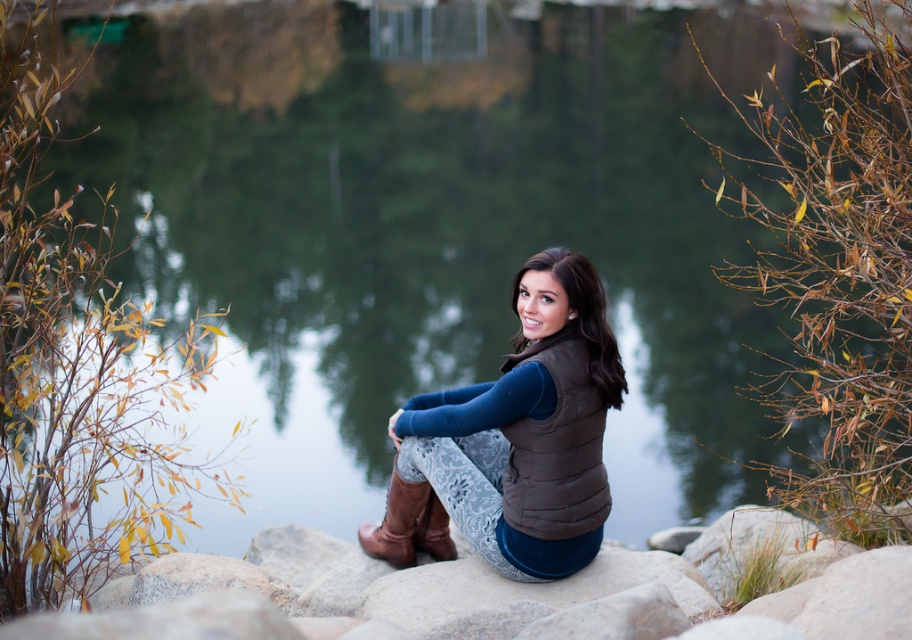
You are standing at the edge of the water and want to place a small decorative item exactly where the brown textured stone at center is located. What are the coordinates of the spot you should aim for?

The coordinates for the brown textured stone at center are at point (394,600).

You are a photographer standing at the edge of the water. You want to take a photo of the brown quilted vest at center and the brown textured stone at center in the same frame. Given that your camera has a maximum focus range of 12 inches, will both objects be in focus?

The distance between the brown textured stone at center and the brown quilted vest at center is 12.98 inches, which exceeds the camera maximum focus range of 12 inches. Therefore, both objects cannot be in focus simultaneously.